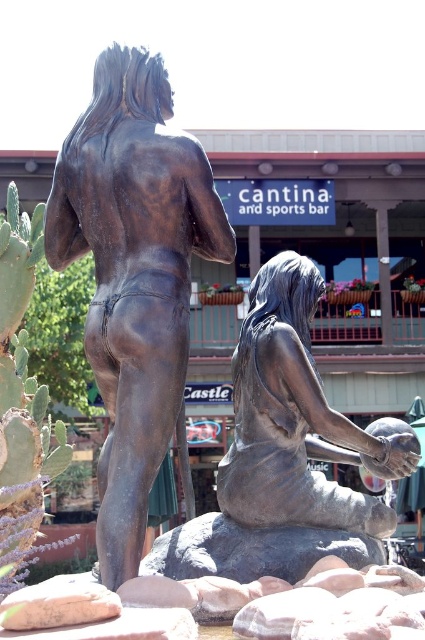
Between bronze statue at left and bronze statue at center, which one appears on the left side from the viewer's perspective?

Positioned to the left is bronze statue at left.

Who is higher up, bronze statue at left or bronze statue at center?

bronze statue at left is above.

This screenshot has width=425, height=640. I want to click on bronze statue at left, so click(135, 276).